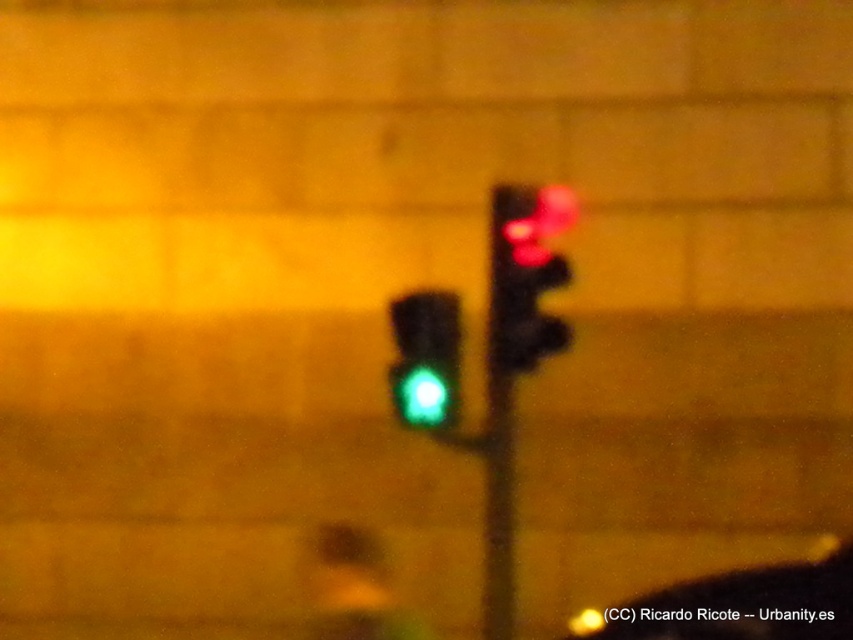
Question: Does matte black traffic light at upper right appear on the right side of green glass traffic light at center?

Choices:
 (A) yes
 (B) no

Answer: (A)

Question: Can you confirm if matte black traffic light at upper right is thinner than green glass traffic light at center?

Choices:
 (A) yes
 (B) no

Answer: (B)

Question: Is matte black traffic light at upper right wider than green glass traffic light at center?

Choices:
 (A) yes
 (B) no

Answer: (A)